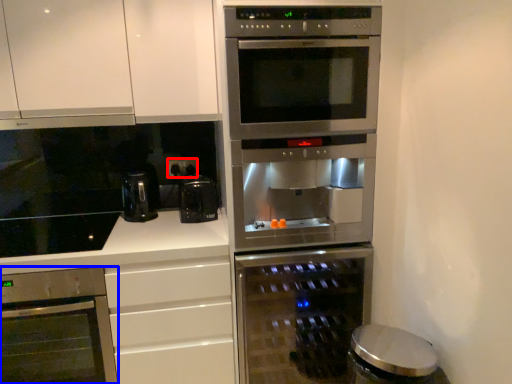
Question: Which object is closer to the camera taking this photo, electric outlet (highlighted by a red box) or oven (highlighted by a blue box)?

Choices:
 (A) electric outlet
 (B) oven

Answer: (B)